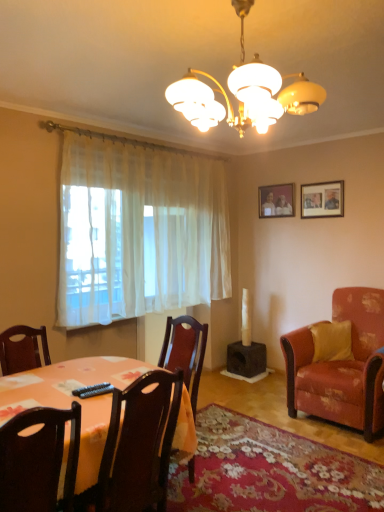
Question: Would you say black plastic remote control at lower center is inside or outside wooden picture frame at upper right, marked as the second picture frame in a back-to-front arrangement?

Choices:
 (A) outside
 (B) inside

Answer: (A)

Question: From the image's perspective, is black plastic remote control at lower center above or below wooden picture frame at upper right, which is the second picture frame from left to right?

Choices:
 (A) above
 (B) below

Answer: (B)

Question: Which of these objects is positioned closest to the orange fabric placemat at lower left?

Choices:
 (A) black plastic remote control at lower center
 (B) white sheer curtain at left
 (C) yellow fabric pillow at right
 (D) orange fabric table at lower left
 (E) wooden picture frame at upper right, which is the 1th picture frame in right-to-left order

Answer: (D)

Question: Which object is the closest to the dark wood chair at lower left, which ranks as the third chair in back-to-front order?

Choices:
 (A) dark wood chair at center, the second chair when ordered from front to back
 (B) wooden photo frame at upper center, the 2th picture frame positioned from the front
 (C) orange fabric placemat at lower left
 (D) yellow fabric pillow at right
 (E) wooden picture frame at upper right, marked as the second picture frame in a back-to-front arrangement

Answer: (A)